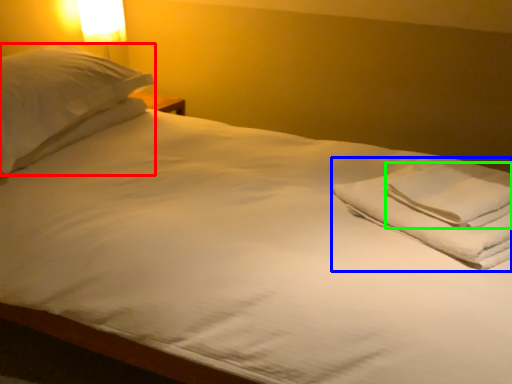
Question: Estimate the real-world distances between objects in this image. Which object is farther from pillow (highlighted by a red box), material (highlighted by a blue box) or hand towel (highlighted by a green box)?

Choices:
 (A) material
 (B) hand towel

Answer: (B)